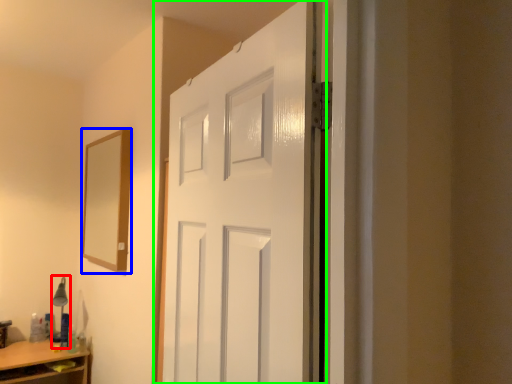
Question: Which is farther away from table lamp (highlighted by a red box)? mirror (highlighted by a blue box) or door (highlighted by a green box)?

Choices:
 (A) mirror
 (B) door

Answer: (B)